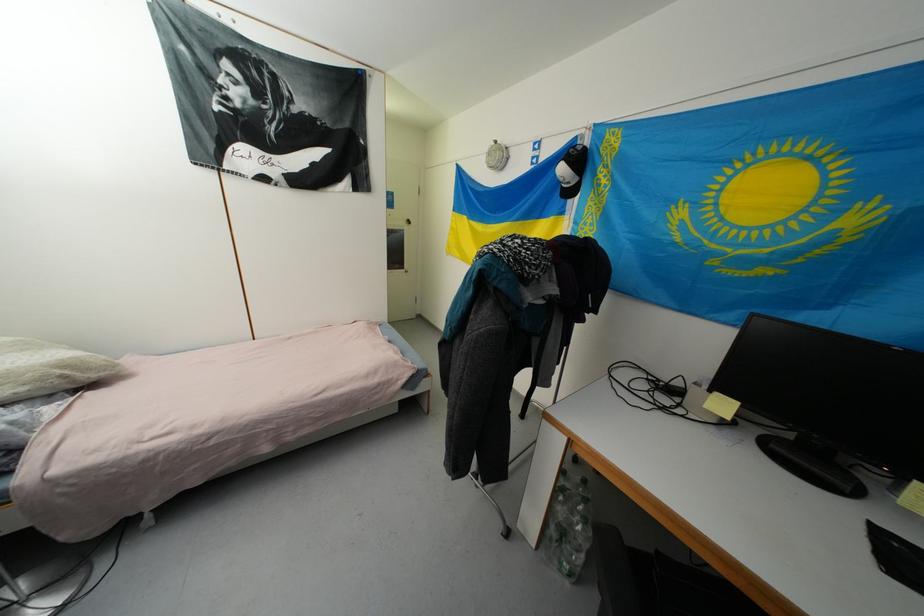
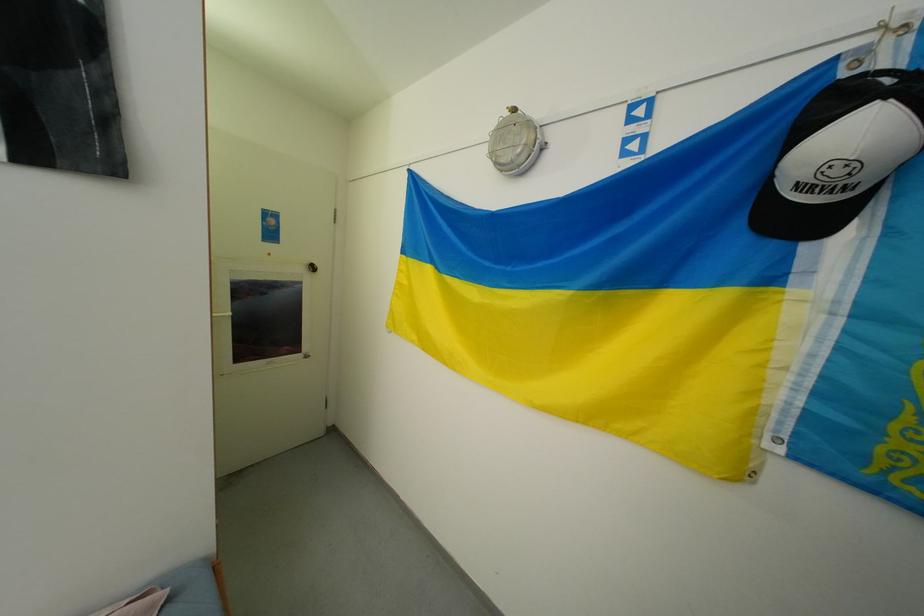
Question: In a continuous first-person perspective shot, in which direction is the camera moving?

Choices:
 (A) Left
 (B) Right
 (C) Forward
 (D) Backward

Answer: (C)